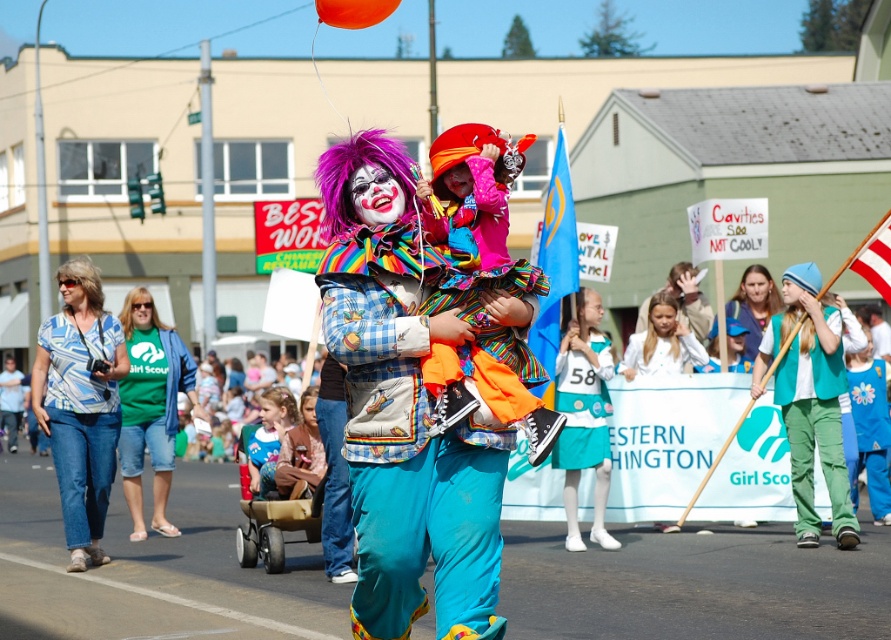
You are a photographer standing at the starting point of the parade route. You want to capture a photo of the white and red striped flag at center from a distance of exactly 50 feet. Is the current position of the photographer sufficient to achieve this?

The white and red striped flag at center is currently 48.08 feet away from the camera. Since this distance is less than 50 feet, the photographer needs to move back approximately 1.92 feet to reach the desired distance of 50 feet.

You are a photographer trying to capture the entire scene of the parade. You notice the white and red striped flag at center and the blonde synthetic wig at upper left. Which object should you focus on to ensure both are visible in your photo without cropping?

The white and red striped flag at center occupies less space than the blonde synthetic wig at upper left, so focusing on the blonde synthetic wig at upper left would ensure both are visible as it is larger and might be easier to frame without cropping.